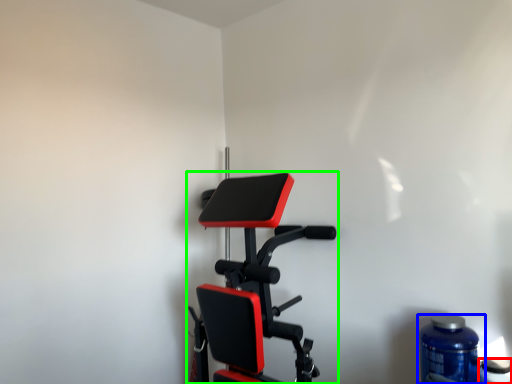
Question: Based on their relative distances, which object is farther from bottle (highlighted by a red box)? Choose from bottle (highlighted by a blue box) and stationary bicycle (highlighted by a green box).

Choices:
 (A) bottle
 (B) stationary bicycle

Answer: (B)